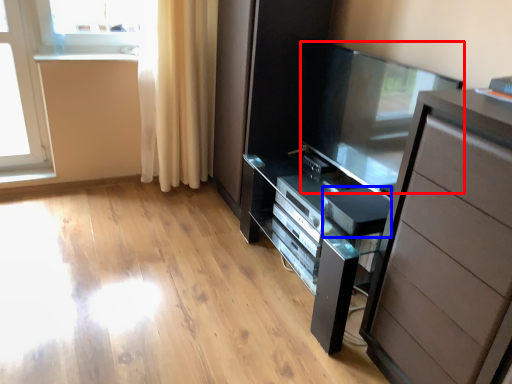
Question: Which object is further to the camera taking this photo, screen door (highlighted by a red box) or appliance (highlighted by a blue box)?

Choices:
 (A) screen door
 (B) appliance

Answer: (B)